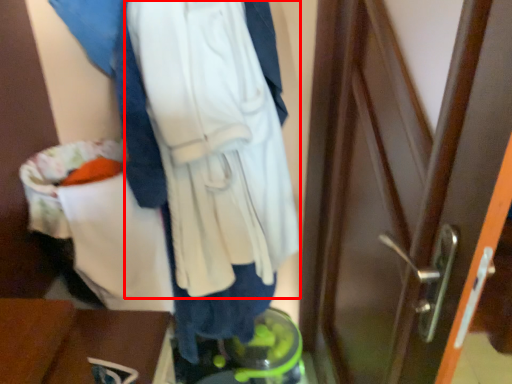
Question: Considering the relative positions of sweatshirt (annotated by the red box) and furniture in the image provided, where is sweatshirt (annotated by the red box) located with respect to the staircase?

Choices:
 (A) left
 (B) right

Answer: (B)